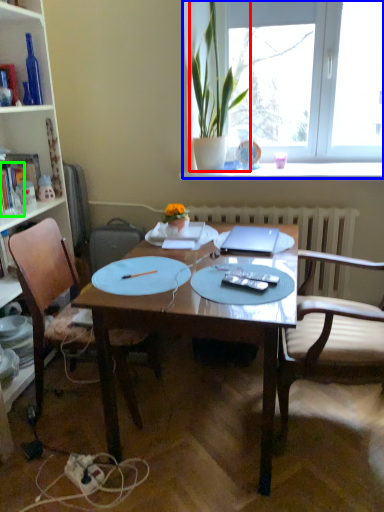
Question: Based on their relative distances, which object is nearer to houseplant (highlighted by a red box)? Choose from window (highlighted by a blue box) and book (highlighted by a green box).

Choices:
 (A) window
 (B) book

Answer: (A)